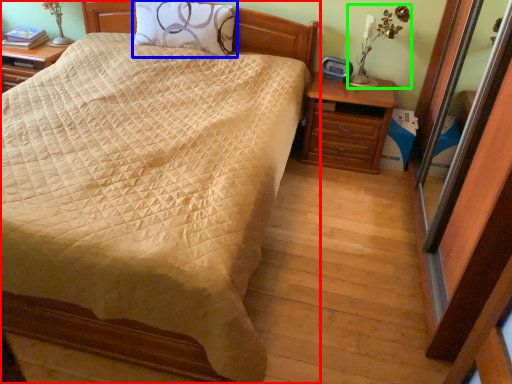
Question: Which object is the closest to the bed (highlighted by a red box)? Choose among these: pillow (highlighted by a blue box) or table lamp (highlighted by a green box).

Choices:
 (A) pillow
 (B) table lamp

Answer: (A)